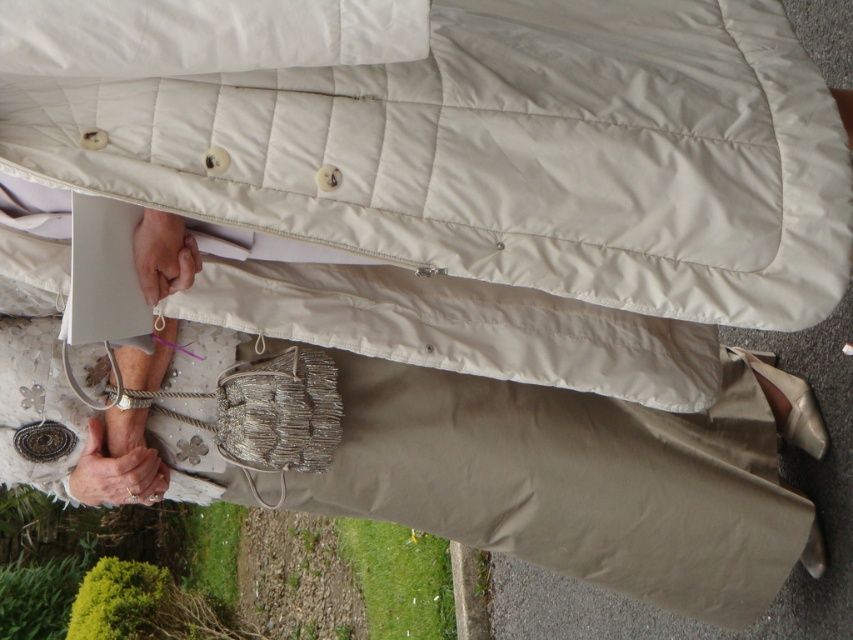
Question: Is white fabric hand at lower left wider than matte beige hand at center?

Choices:
 (A) yes
 (B) no

Answer: (A)

Question: Can you confirm if white quilted pillow at upper center is positioned to the left of matte beige hand at center?

Choices:
 (A) yes
 (B) no

Answer: (B)

Question: Among these points, which one is farthest from the camera?

Choices:
 (A) (254, 44)
 (B) (548, 211)
 (C) (189, 269)

Answer: (C)

Question: Which object is closer to the camera taking this photo?

Choices:
 (A) matte beige hand at center
 (B) white fabric hand at lower left

Answer: (A)

Question: Is white quilted pillow at upper center positioned behind matte beige hand at center?

Choices:
 (A) yes
 (B) no

Answer: (B)

Question: Which object is the closest to the white fabric hand at lower left?

Choices:
 (A) matte beige hand at center
 (B) white quilted pillow at upper center

Answer: (A)